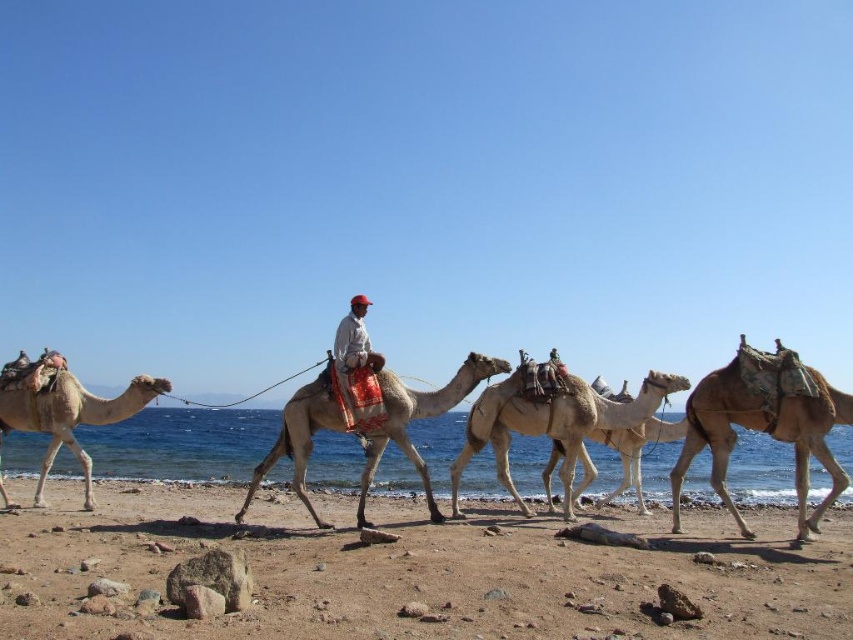
Question: Can you confirm if light brown textured camel at right is positioned to the left of light beige sand-colored camel at left?

Choices:
 (A) yes
 (B) no

Answer: (B)

Question: Does light brown textured camel at right appear on the left side of light gray fabric at center?

Choices:
 (A) yes
 (B) no

Answer: (B)

Question: Observing the image, what is the correct spatial positioning of light beige sand-colored camel at left in reference to light gray fabric at center?

Choices:
 (A) below
 (B) above

Answer: (A)

Question: Which object appears closest to the camera in this image?

Choices:
 (A) light gray fabric at center
 (B) light beige sand-colored camel at left
 (C) brown sandy beach at lower center

Answer: (C)

Question: Based on their relative distances, which object is nearer to the light beige sand-colored camel at left?

Choices:
 (A) light beige textured camel at center
 (B) brown sandy beach at lower center
 (C) light brown textured camel at center

Answer: (C)

Question: Estimate the real-world distances between objects in this image. Which object is closer to the light beige textured camel at center?

Choices:
 (A) light gray fabric at center
 (B) light brown textured camel at right

Answer: (B)